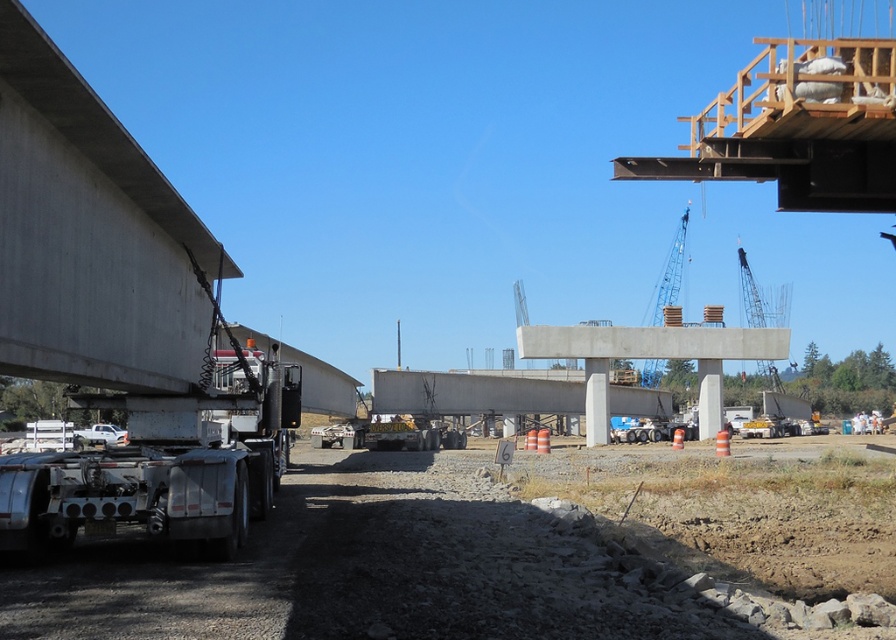
You are a construction worker standing at the origin point of the coordinate system. You need to place a new support beam at the coordinate point where the concrete at center is located. What are the coordinates where you should place the beam?

The coordinates for placing the support beam are at point (475,392) where the concrete at center is located.

You are a construction worker who needs to move a heavy load from the silver metallic trailer truck at left to the metallic gray crane at upper right. Which direction should you move the load to transfer it?

The silver metallic trailer truck at left is to the left of the metallic gray crane at upper right, so you should move the load to the right to transfer it.

In the scene shown: You are a delivery driver who needs to pass through a narrow alley that can only accommodate vehicles narrower than the metallic gray crane at upper right. Can your silver metallic trailer truck at left fit through the alley?

The silver metallic trailer truck at left is narrower than the metallic gray crane at upper right, so it can fit through the alley.